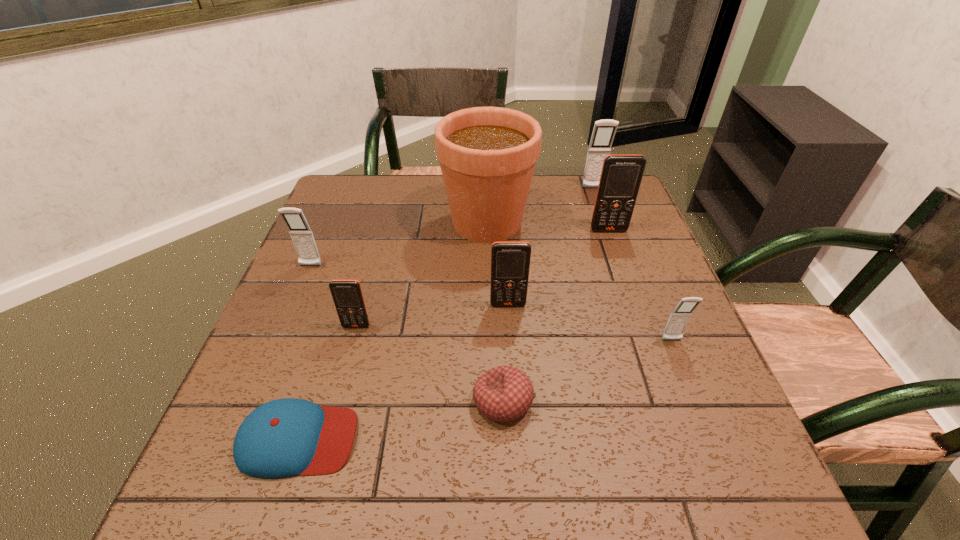
At what (x,y) coordinates should I click in order to perform the action: click on the fourth nearest object. Please return your answer as a coordinate pair (x, y). The height and width of the screenshot is (540, 960). Looking at the image, I should click on [347, 295].

Where is `the third nearest object`? the third nearest object is located at coordinates (679, 318).

This screenshot has width=960, height=540. Find the location of `the rightmost gray cellular telephone`. the rightmost gray cellular telephone is located at coordinates (679, 318).

The width and height of the screenshot is (960, 540). Find the location of `beanbag`. beanbag is located at coordinates (504, 393).

Locate an element on the screen. baseball cap is located at coordinates (287, 437).

At what (x,y) coordinates should I click in order to perform the action: click on free space located on the left of the flowerpot. Please return your answer as a coordinate pair (x, y). Looking at the image, I should click on 391,222.

The image size is (960, 540). What are the coordinates of `vacant space located on the front-facing side of the farthest gray cellular telephone` in the screenshot? It's located at (612, 244).

This screenshot has width=960, height=540. In order to click on free space located 0.210m on the screen of the rightmost orange cellular telephone in this screenshot , I will do `click(629, 287)`.

This screenshot has height=540, width=960. What are the coordinates of `free space located on the front-facing side of the leftmost cellular telephone` in the screenshot? It's located at (261, 383).

At what (x,y) coordinates should I click in order to perform the action: click on vacant space located on the screen of the second nearest orange cellular telephone. Please return your answer as a coordinate pair (x, y). The image size is (960, 540). Looking at the image, I should click on (511, 347).